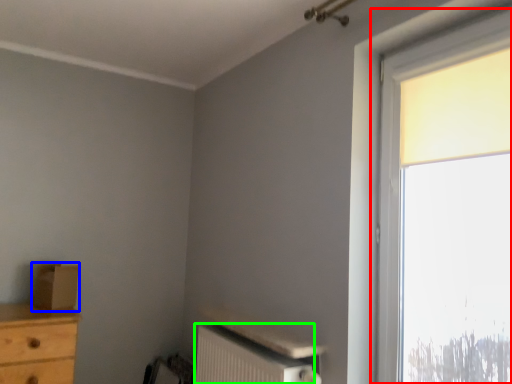
Question: Based on their relative distances, which object is nearer to window (highlighted by a red box)? Choose from cardboard box (highlighted by a blue box) and radiator (highlighted by a green box).

Choices:
 (A) cardboard box
 (B) radiator

Answer: (B)